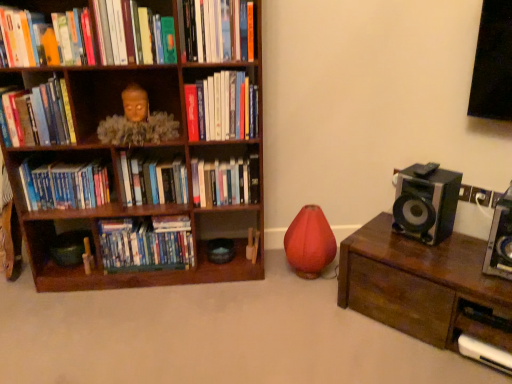
Where is `vacant space that's between brown wooden bookcase at left and wooden chest at right`? Image resolution: width=512 pixels, height=384 pixels. vacant space that's between brown wooden bookcase at left and wooden chest at right is located at coordinates (259, 308).